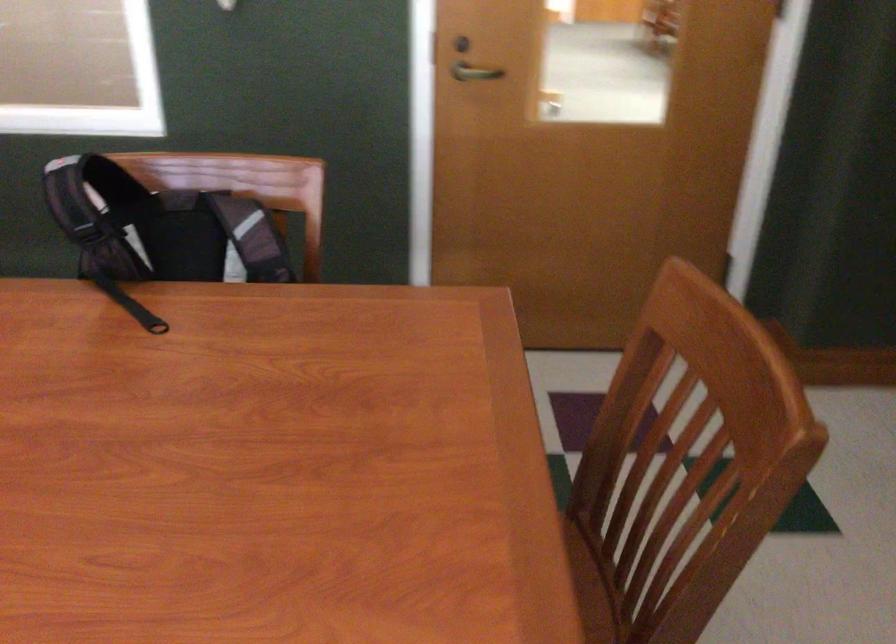
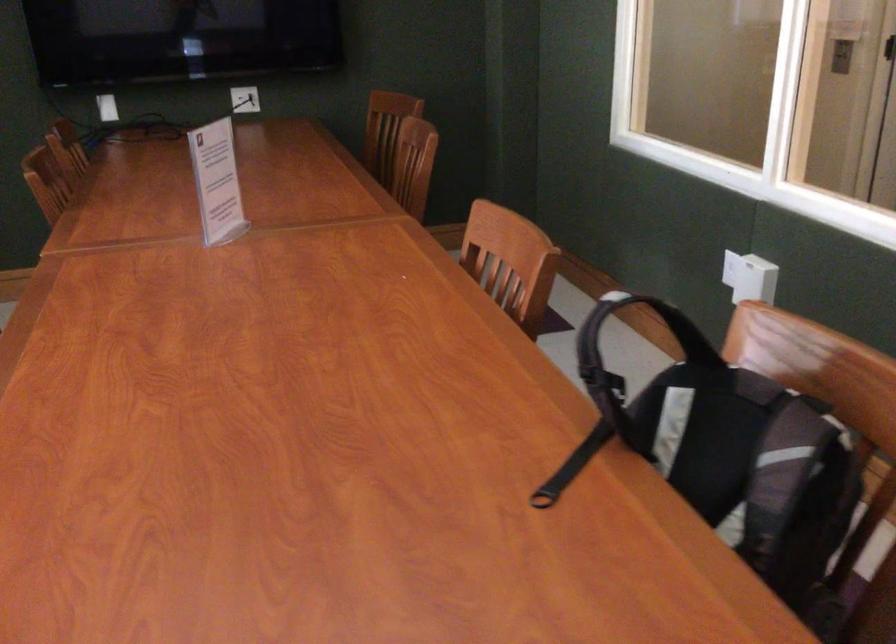
Question: How did the camera likely rotate?

Choices:
 (A) Left
 (B) Right
 (C) Up
 (D) Down

Answer: (A)